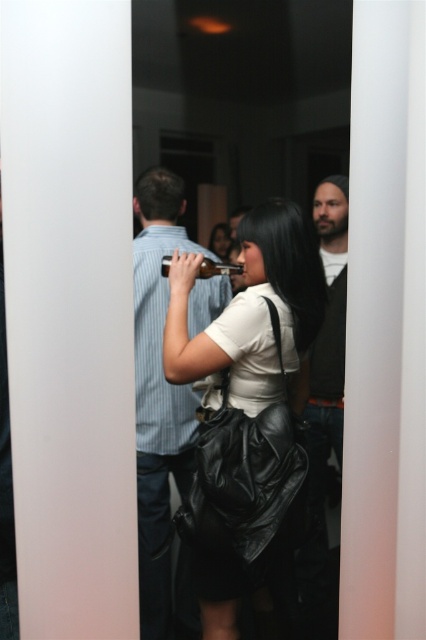
Can you confirm if matte black bag at center is wider than matte black purse at center?

Correct, the width of matte black bag at center exceeds that of matte black purse at center.

Does matte black bag at center appear on the right side of matte black purse at center?

Indeed, matte black bag at center is positioned on the right side of matte black purse at center.

Which is in front, point (294, 230) or point (213, 246)?

Point (294, 230)

At what (x,y) coordinates should I click in order to perform the action: click on matte black bag at center. Please return your answer as a coordinate pair (x, y). This screenshot has height=640, width=426. Looking at the image, I should click on (287, 275).

Is dark brown leather jacket at right shorter than matte black purse at center?

Incorrect, dark brown leather jacket at right's height does not fall short of matte black purse at center's.

Between dark brown leather jacket at right and matte black purse at center, which one has more height?

With more height is dark brown leather jacket at right.

Is point (319, 248) positioned in front of point (227, 241)?

That is True.

This screenshot has height=640, width=426. In order to click on dark brown leather jacket at right in this screenshot , I will do `click(325, 404)`.

This screenshot has height=640, width=426. I want to click on blue striped shirt at center, so point(158,392).

Does blue striped shirt at center appear on the right side of matte black purse at center?

No, blue striped shirt at center is not to the right of matte black purse at center.

The image size is (426, 640). What do you see at coordinates (158, 392) in the screenshot?
I see `blue striped shirt at center` at bounding box center [158, 392].

Where is `blue striped shirt at center`? This screenshot has width=426, height=640. blue striped shirt at center is located at coordinates (158, 392).